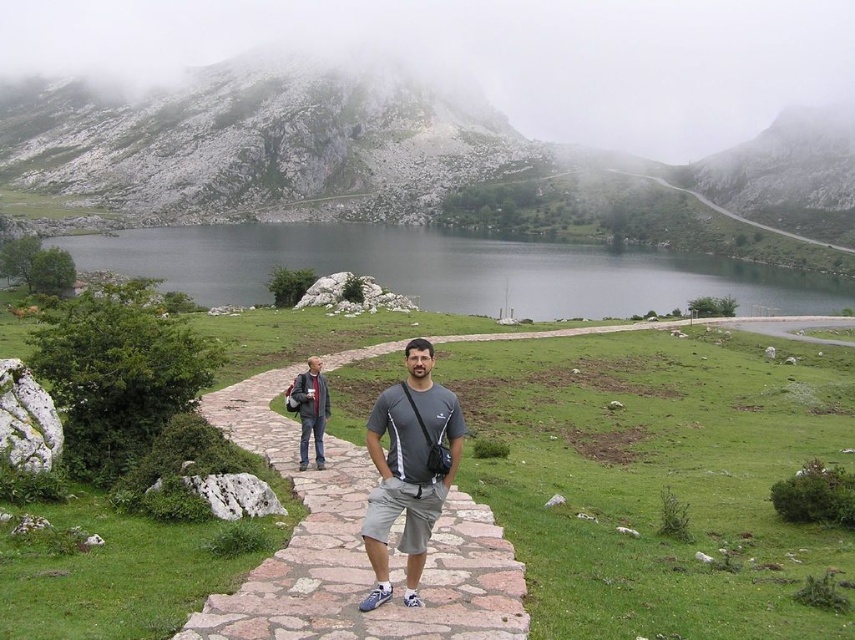
Question: Estimate the real-world distances between objects in this image. Which object is farther from the rocky gray mountain at upper left?

Choices:
 (A) gray fabric shirt at center
 (B) stone paved path at center
 (C) dark gray fabric jacket at center-left

Answer: (C)

Question: Which point is farther to the camera?

Choices:
 (A) gray fabric shirt at center
 (B) stone paved path at center
 (C) rocky gray mountain at upper left
 (D) smooth gray water at center

Answer: (C)

Question: Which point is farther to the camera?

Choices:
 (A) stone paved path at center
 (B) rocky gray mountain at upper left

Answer: (B)

Question: Is rocky gray mountain at upper left to the left of smooth gray water at center from the viewer's perspective?

Choices:
 (A) no
 (B) yes

Answer: (B)

Question: Observing the image, what is the correct spatial positioning of rocky gray mountain at upper left in reference to smooth gray water at center?

Choices:
 (A) above
 (B) below

Answer: (A)

Question: Is smooth gray water at center closer to the viewer compared to stone paved path at center?

Choices:
 (A) yes
 (B) no

Answer: (B)